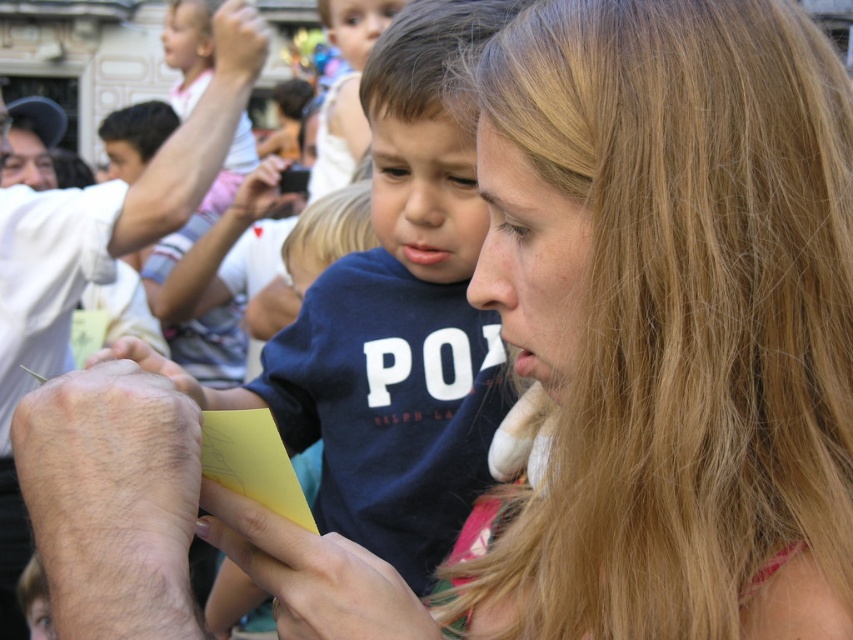
Who is lower down, hairy skin at lower left or dark brown hair at upper left?

hairy skin at lower left is below.

At what (x,y) coordinates should I click in order to perform the action: click on hairy skin at lower left. Please return your answer as a coordinate pair (x, y). The height and width of the screenshot is (640, 853). Looking at the image, I should click on (103, 240).

Does point (453, 240) come closer to viewer compared to point (286, 260)?

Yes, it is.

Is blue cotton shirt at center taller than blonde smooth hair at center?

Yes, blue cotton shirt at center is taller than blonde smooth hair at center.

Image resolution: width=853 pixels, height=640 pixels. I want to click on blue cotton shirt at center, so click(x=397, y=310).

The width and height of the screenshot is (853, 640). What are the coordinates of `blue cotton shirt at center` in the screenshot? It's located at (397, 310).

Who is positioned more to the left, blonde smooth hair at center or dark brown hair at upper left?

Positioned to the left is dark brown hair at upper left.

Does blonde smooth hair at center come in front of dark brown hair at upper left?

Yes, it is.

Who is more distant from viewer, (368, 189) or (160, 134)?

Point (160, 134)

This screenshot has width=853, height=640. In order to click on blonde smooth hair at center in this screenshot , I will do `click(329, 228)`.